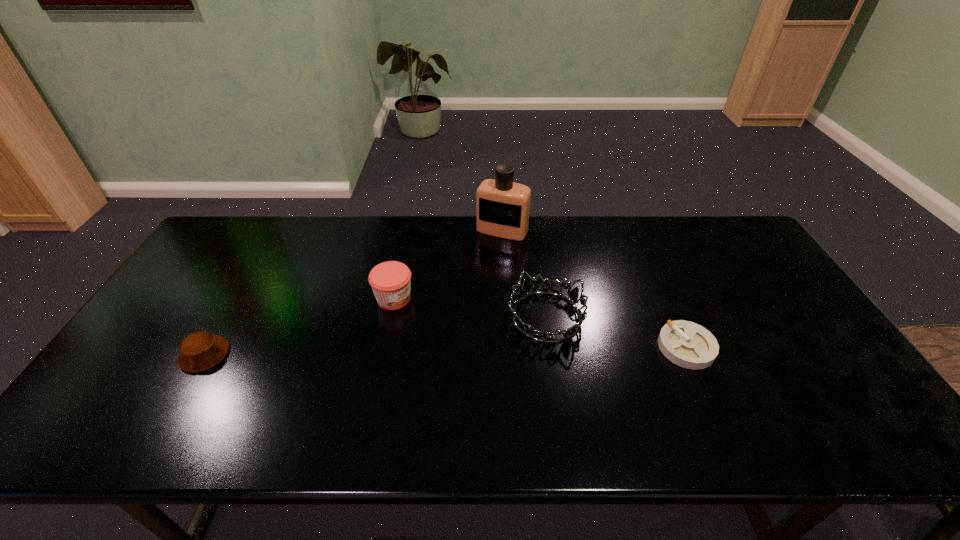
Find the location of `object located at the left edge`. object located at the left edge is located at coordinates (201, 350).

The width and height of the screenshot is (960, 540). In order to click on free space at the far edge of the desktop in this screenshot , I will do `click(312, 221)`.

The image size is (960, 540). Find the location of `free space at the near edge of the desktop`. free space at the near edge of the desktop is located at coordinates (498, 405).

This screenshot has height=540, width=960. I want to click on free space at the left edge of the desktop, so click(x=218, y=289).

In the image, there is a desktop. Where is `vacant space at the right edge`? Image resolution: width=960 pixels, height=540 pixels. vacant space at the right edge is located at coordinates (767, 313).

The image size is (960, 540). I want to click on blank space at the far left corner, so click(248, 255).

Identify the location of vacant space at the far right corner of the desktop. (735, 229).

Find the location of `vacant area that lies between the tiara and the fourth tallest object`. vacant area that lies between the tiara and the fourth tallest object is located at coordinates (375, 335).

Locate an element on the screen. This screenshot has width=960, height=540. empty location between the rightmost object and the second object from left to right is located at coordinates point(540,323).

At what (x,y) coordinates should I click in order to perform the action: click on vacant space that's between the second shortest object and the jam. Please return your answer as a coordinate pair (x, y). Looking at the image, I should click on (300, 327).